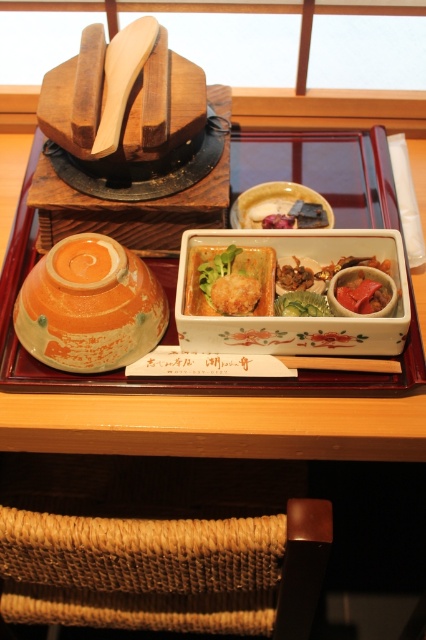
Consider the image. You are a server in a traditional Japanese restaurant and need to place a new dish on the table. The wooden tray at center and the matte brown rectangular dish at center are already present. Based on their positions, where should you place the new dish to maintain symmetry?

→ The wooden tray at center is positioned on the right side of matte brown rectangular dish at center, so to maintain symmetry, the new dish should be placed on the left side of the matte brown rectangular dish at center.

You are a guest at this traditional Japanese meal. You notice the wooden tray at center and the matte brown rectangular dish at center. Which object is closer to you?

The wooden tray at center is closer to you because it is in front of the matte brown rectangular dish at center.

You are a guest at a traditional Japanese meal. You want to pick up the matte orange bowl at left and the matte brown rectangular dish at center. Which one can you reach first without moving your current position?

The matte orange bowl at left is closer to the viewer than the matte brown rectangular dish at center, so you can reach the matte orange bowl at left first without moving.